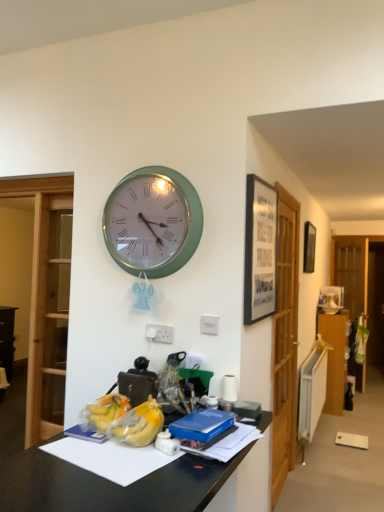
Where is `free space on the front side of translucent plastic bananas at center`? The height and width of the screenshot is (512, 384). free space on the front side of translucent plastic bananas at center is located at coordinates (122, 464).